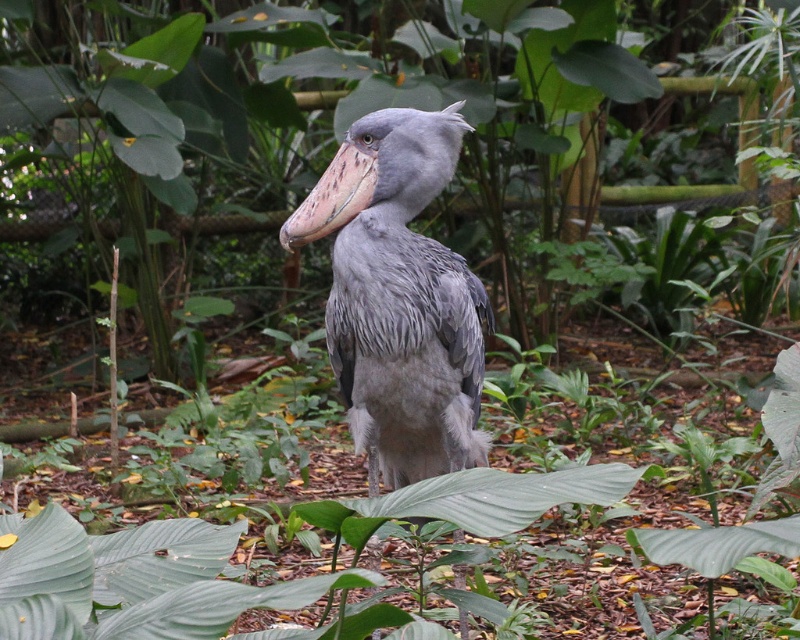
Between gray matte bird at center and pinkish-brown textured beak at center, which one has less height?

With less height is pinkish-brown textured beak at center.

Find the location of a particular element. The width and height of the screenshot is (800, 640). gray matte bird at center is located at coordinates (400, 298).